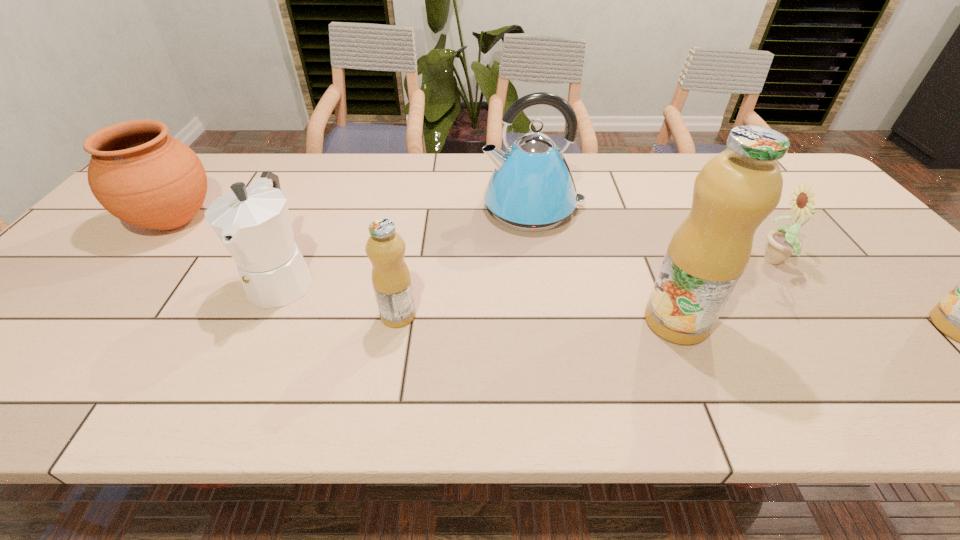
Considering the uniform spacing of fruit juices, where should an additional fruit juice be positioned on the left? Please locate a free spot. Please provide its 2D coordinates. Your answer should be formatted as a tuple, i.e. [(x, y)], where the tuple contains the x and y coordinates of a point satisfying the conditions above.

[(128, 309)]